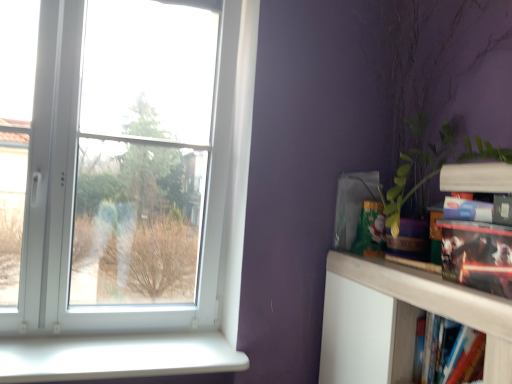
Question: Is white plastic window sill at lower left oriented away from white plastic window at upper left?

Choices:
 (A) yes
 (B) no

Answer: (B)

Question: Is white plastic window sill at lower left located outside white plastic window at upper left?

Choices:
 (A) yes
 (B) no

Answer: (A)

Question: Is white plastic window sill at lower left shorter than white plastic window at upper left?

Choices:
 (A) no
 (B) yes

Answer: (B)

Question: Can you confirm if white plastic window sill at lower left is positioned to the left of white plastic window at upper left?

Choices:
 (A) yes
 (B) no

Answer: (B)

Question: Is white plastic window sill at lower left wider than white plastic window at upper left?

Choices:
 (A) no
 (B) yes

Answer: (B)

Question: In terms of width, does white plastic window at upper left look wider or thinner when compared to green leafy plant at right?

Choices:
 (A) thin
 (B) wide

Answer: (A)

Question: From their relative heights in the image, would you say white plastic window at upper left is taller or shorter than green leafy plant at right?

Choices:
 (A) short
 (B) tall

Answer: (B)

Question: Is white plastic window at upper left in front of or behind green leafy plant at right in the image?

Choices:
 (A) behind
 (B) front

Answer: (A)

Question: Is white plastic window at upper left to the left or to the right of green leafy plant at right in the image?

Choices:
 (A) left
 (B) right

Answer: (A)

Question: Choose the correct answer: Is white plastic window at upper left inside white matte shelf at upper right or outside it?

Choices:
 (A) inside
 (B) outside

Answer: (B)

Question: Is point (225, 59) closer or farther from the camera than point (440, 284)?

Choices:
 (A) closer
 (B) farther

Answer: (B)

Question: From the image's perspective, relative to white matte shelf at upper right, is white plastic window at upper left above or below?

Choices:
 (A) below
 (B) above

Answer: (B)

Question: Based on their positions, is white plastic window at upper left located to the left or right of white matte shelf at upper right?

Choices:
 (A) left
 (B) right

Answer: (A)

Question: Looking at the image, does white plastic window sill at lower left seem bigger or smaller compared to green leafy plant at right?

Choices:
 (A) small
 (B) big

Answer: (A)

Question: Does point (201, 340) appear closer or farther from the camera than point (474, 46)?

Choices:
 (A) farther
 (B) closer

Answer: (A)